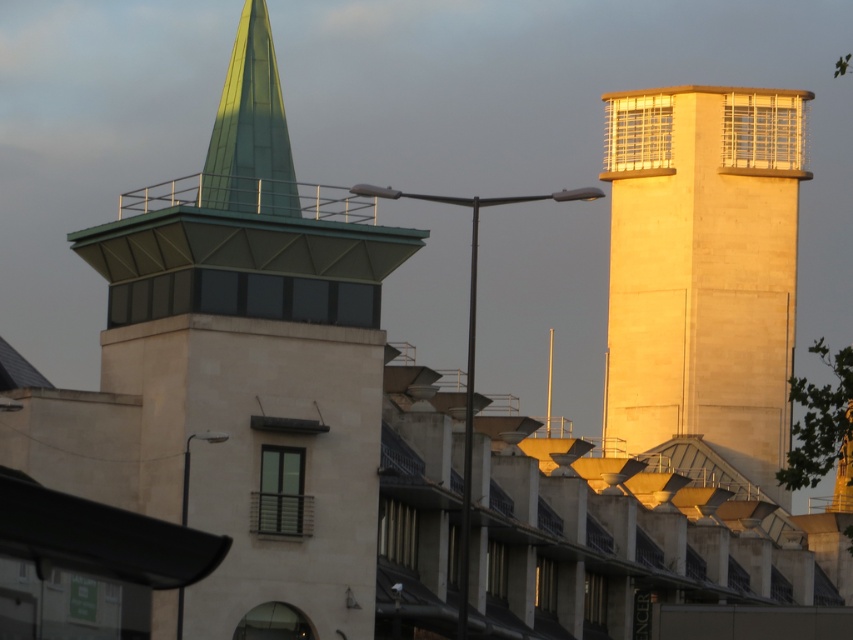
You are an architect reviewing this design. You need to install a new light between the beige stone tower at right and the green glass spire at upper left. Based on their positions, where should the light be placed?

The beige stone tower at right is located below the green glass spire at upper left, so the light should be placed between them horizontally, ensuring it is positioned above the beige stone tower at right and below the green glass spire at upper left to maintain proper alignment.

You are an architect designing a new lighting system for the area between the green stone tower at upper left and the green glass spire at upper left. Which structure should you place the spotlight closer to if you want to highlight the taller one?

The green stone tower at upper left is taller than the green glass spire at upper left, so you should place the spotlight closer to the green stone tower at upper left to highlight its height effectively.

You are a drone operator who needs to fly a drone between the beige stone tower at right and the green glass spire at upper left. The drone has a maximum flight range of 100 meters. Can the drone safely make the trip between them without running out of battery?

The distance between the beige stone tower at right and the green glass spire at upper left is 105.16 meters, which exceeds the drone operator stated maximum flight range of 100 meters. The drone cannot safely make the trip without running out of battery.